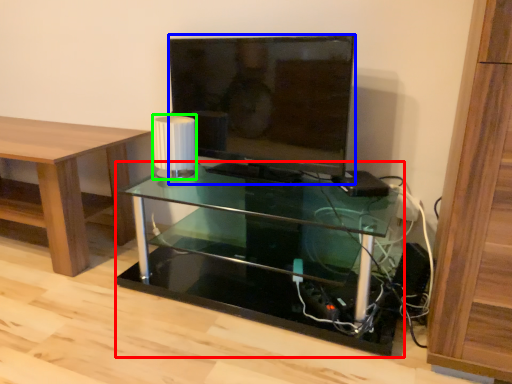
Question: Which is nearer to the shelf (highlighted by a red box)? television (highlighted by a blue box) or lamp (highlighted by a green box).

Choices:
 (A) television
 (B) lamp

Answer: (A)